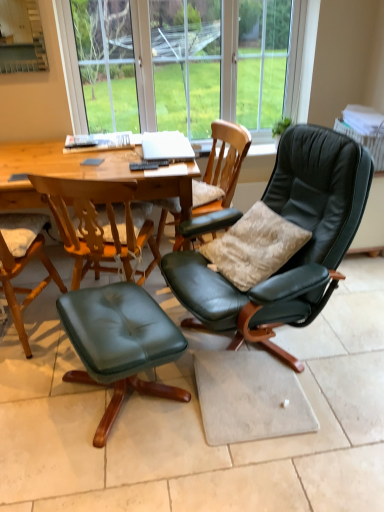
Locate an element on the screen. The height and width of the screenshot is (512, 384). empty space that is to the right of green leather ottoman at lower left is located at coordinates (237, 417).